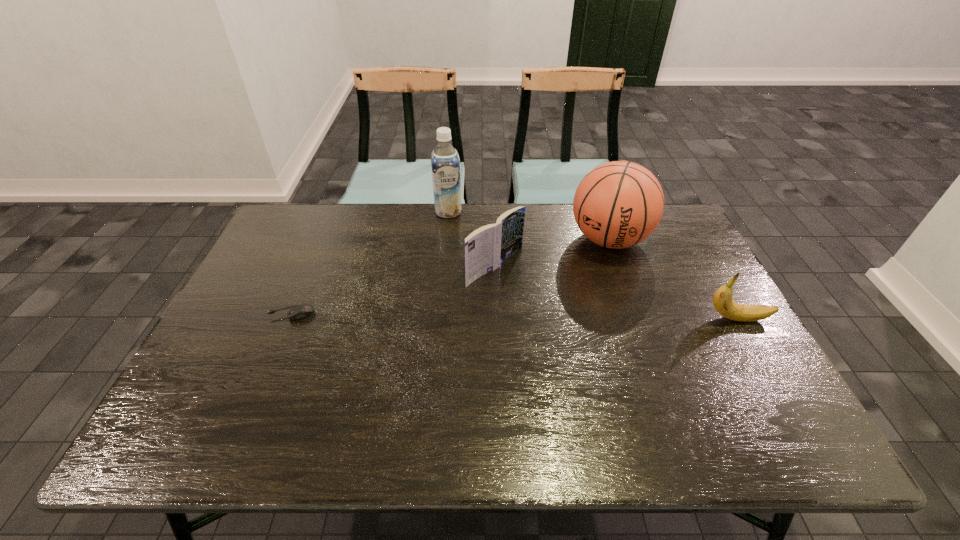
This screenshot has width=960, height=540. What are the coordinates of `empty space between the shortest object and the fourth object from left to right` in the screenshot? It's located at (450, 276).

This screenshot has height=540, width=960. Identify the location of empty space between the shortest object and the soya milk. (370, 262).

The image size is (960, 540). I want to click on free space between the mouse and the basketball, so click(450, 276).

Identify the location of blank region between the rightmost object and the shortest object. The height and width of the screenshot is (540, 960). (514, 316).

Identify the location of object identified as the closest to the rightmost object. (619, 204).

The image size is (960, 540). Identify the location of object that stands as the fourth closest to the mouse. (722, 300).

The image size is (960, 540). I want to click on free space that satisfies the following two spatial constraints: 1. on the front side of the banana; 2. at the start of the peel on the third object from right to left, so click(497, 319).

Identify the location of vacant area in the image that satisfies the following two spatial constraints: 1. on the front side of the fourth object from left to right; 2. on the right side of the soya milk. The image size is (960, 540). (445, 240).

I want to click on vacant space that satisfies the following two spatial constraints: 1. on the front side of the rightmost object; 2. at the start of the peel on the basketball, so click(636, 319).

Locate an element on the screen. The width and height of the screenshot is (960, 540). vacant space that satisfies the following two spatial constraints: 1. on the front side of the banana; 2. at the start of the peel on the basketball is located at coordinates (636, 319).